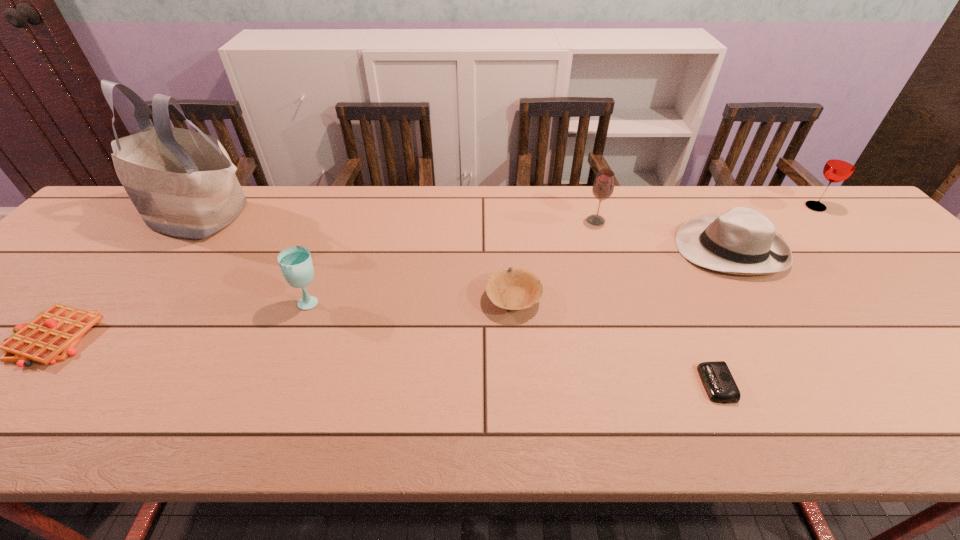
Where is `the sixth object from left to right`? The image size is (960, 540). the sixth object from left to right is located at coordinates (717, 379).

At what (x,y) coordinates should I click in order to perform the action: click on alarm clock. Please return your answer as a coordinate pair (x, y). The width and height of the screenshot is (960, 540). Looking at the image, I should click on (717, 379).

I want to click on vacant region located 0.060m on the left of the tallest object, so click(111, 215).

Find the location of a particular element. The width and height of the screenshot is (960, 540). blank space located 0.350m on the left of the rightmost glass is located at coordinates (686, 207).

At what (x,y) coordinates should I click in order to perform the action: click on vacant area situated 0.150m on the left of the fourth object from right to left. Please return your answer as a coordinate pair (x, y). Looking at the image, I should click on (534, 221).

Image resolution: width=960 pixels, height=540 pixels. Identify the location of free space located on the back of the leftmost glass. (324, 268).

The image size is (960, 540). Identify the location of blank area located 0.160m on the front-facing side of the second object from right to left. (617, 249).

At what (x,y) coordinates should I click in order to perform the action: click on free space located 0.070m on the front-facing side of the second object from right to left. Please return your answer as a coordinate pair (x, y). Looking at the image, I should click on (651, 249).

This screenshot has width=960, height=540. I want to click on free space located 0.120m on the front-facing side of the second object from right to left, so click(x=633, y=249).

At what (x,y) coordinates should I click in order to perform the action: click on vacant area situated on the front of the fifth object from right to left. Please return your answer as a coordinate pair (x, y). Image resolution: width=960 pixels, height=540 pixels. Looking at the image, I should click on (518, 358).